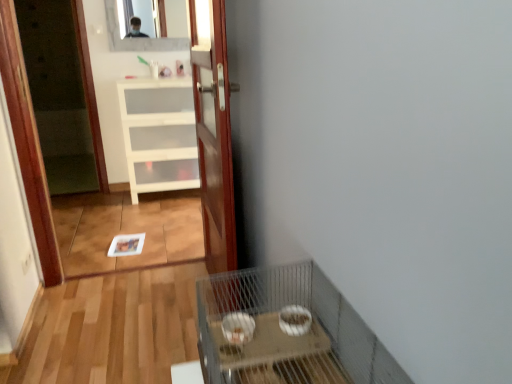
Question: From a real-world perspective, is wooden door at center above or below clear glass mirror at upper center?

Choices:
 (A) above
 (B) below

Answer: (B)

Question: Considering the positions of wooden door at center and clear glass mirror at upper center in the image, is wooden door at center wider or thinner than clear glass mirror at upper center?

Choices:
 (A) wide
 (B) thin

Answer: (A)

Question: Which object is the closest to the clear glass mirror at upper center?

Choices:
 (A) white matte cabinet at center
 (B) wooden door at center
 (C) metal wire cage at lower right

Answer: (A)

Question: Which is farther from the white matte cabinet at center?

Choices:
 (A) wooden door at center
 (B) metal wire cage at lower right
 (C) clear glass mirror at upper center

Answer: (B)